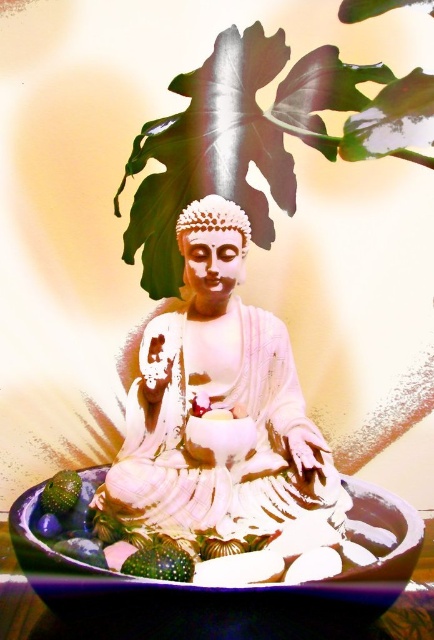
Can you confirm if green matte/soft fruit at lower center is wider than green matte avocado at lower left?

Correct, the width of green matte/soft fruit at lower center exceeds that of green matte avocado at lower left.

Between green matte/soft fruit at lower center and green matte avocado at lower left, which one appears on the right side from the viewer's perspective?

green matte/soft fruit at lower center

Which is behind, point (147, 557) or point (52, 512)?

The point (52, 512) is behind.

Locate an element on the screen. This screenshot has width=434, height=640. green matte/soft fruit at lower center is located at coordinates (160, 563).

Between green leafy plant at upper center and matte ceramic bowl at center, which one has more height?

With more height is green leafy plant at upper center.

Is green leafy plant at upper center below matte ceramic bowl at center?

Actually, green leafy plant at upper center is above matte ceramic bowl at center.

Who is more distant from viewer, (224, 54) or (134, 579)?

The point (224, 54) is more distant.

Identify the location of green leafy plant at upper center. The width and height of the screenshot is (434, 640). (259, 138).

Between white glossy statue at center and green matte avocado at lower left, which one is positioned higher?

white glossy statue at center is above.

Does white glossy statue at center appear on the right side of green matte avocado at lower left?

Indeed, white glossy statue at center is positioned on the right side of green matte avocado at lower left.

Is point (336, 480) positioned after point (53, 481)?

No, (336, 480) is in front of (53, 481).

In order to click on white glossy statue at center in this screenshot , I will do `click(222, 410)`.